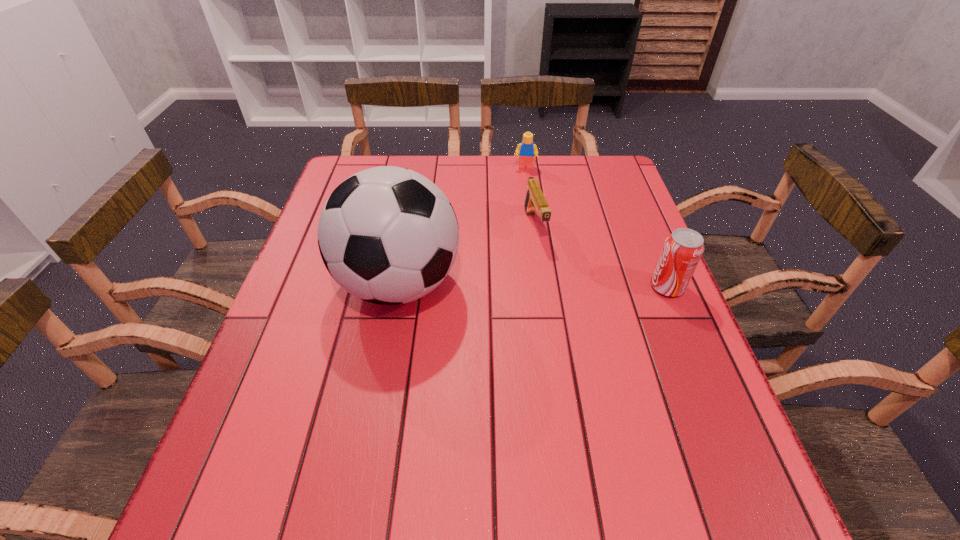
Where is `free space on the desktop that is between the leftmost object and the third shortest object and is positioned on the front-facing side of the farthest object`? This screenshot has height=540, width=960. free space on the desktop that is between the leftmost object and the third shortest object and is positioned on the front-facing side of the farthest object is located at coordinates (517, 286).

Locate an element on the screen. The width and height of the screenshot is (960, 540). free spot on the desktop that is between the leftmost object and the soda can and is positioned at the barrel of the pistol is located at coordinates (559, 286).